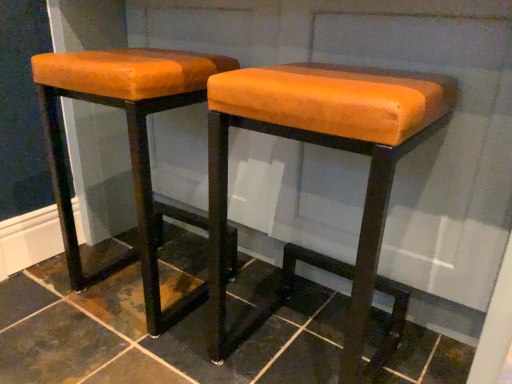
At what (x,y) coordinates should I click in order to perform the action: click on space that is in front of orange leather stool at left, placed as the second stool when sorted from right to left. Please return your answer as a coordinate pair (x, y). This screenshot has height=384, width=512. Looking at the image, I should click on (110, 354).